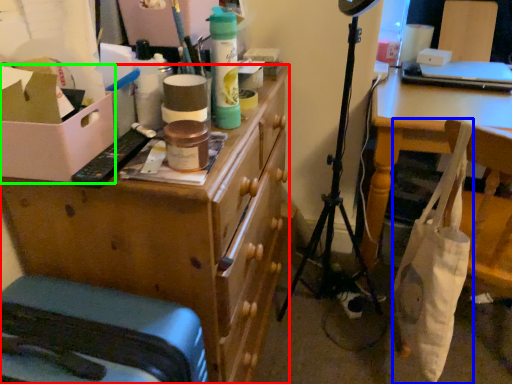
Question: Which is farther away from desk (highlighted by a red box)? bag (highlighted by a blue box) or cardboard box (highlighted by a green box)?

Choices:
 (A) bag
 (B) cardboard box

Answer: (A)